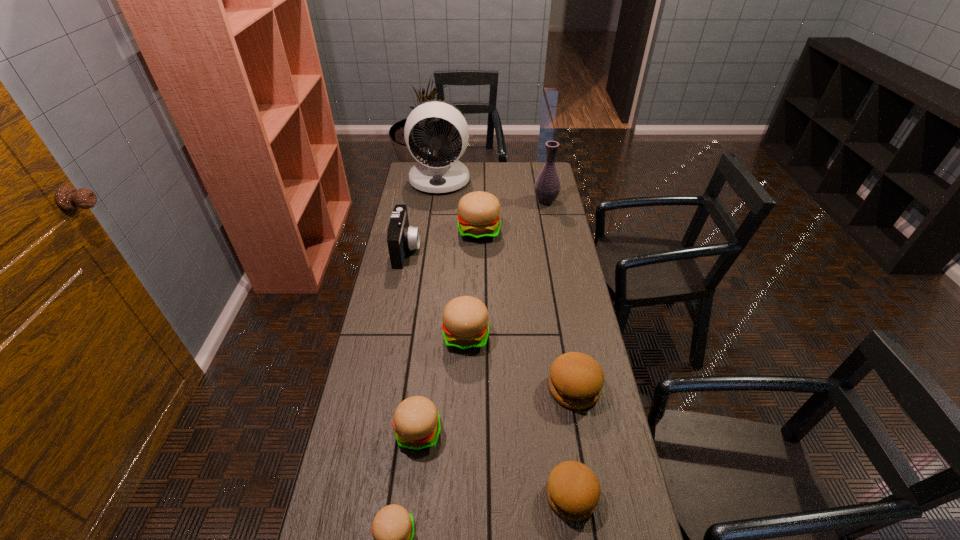
Where is `gray fan`? This screenshot has height=540, width=960. gray fan is located at coordinates (442, 173).

This screenshot has width=960, height=540. What are the coordinates of `the tallest object` in the screenshot? It's located at (442, 173).

Identify the location of vase. The height and width of the screenshot is (540, 960). (547, 186).

Locate an element on the screen. The width and height of the screenshot is (960, 540). the farthest beige hamburger is located at coordinates (478, 217).

I want to click on the biggest beige hamburger, so click(478, 217).

Image resolution: width=960 pixels, height=540 pixels. In order to click on camcorder in this screenshot , I will do `click(401, 237)`.

Where is `the fifth shortest hamburger`? the fifth shortest hamburger is located at coordinates (465, 326).

At what (x,y) coordinates should I click in order to perform the action: click on the fifth nearest hamburger. Please return your answer as a coordinate pair (x, y). The image size is (960, 540). Looking at the image, I should click on (465, 326).

Identify the location of the fourth farthest hamburger. This screenshot has width=960, height=540. point(416,421).

This screenshot has width=960, height=540. Identify the location of the second nearest beige hamburger. (416, 421).